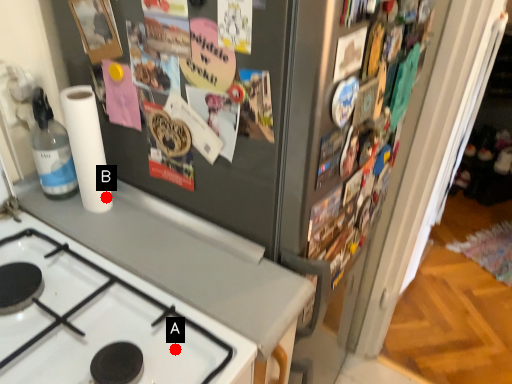
Question: Two points are circled on the image, labeled by A and B beside each circle. Among these points, which one is farthest from the camera?

Choices:
 (A) A is further
 (B) B is further

Answer: (B)